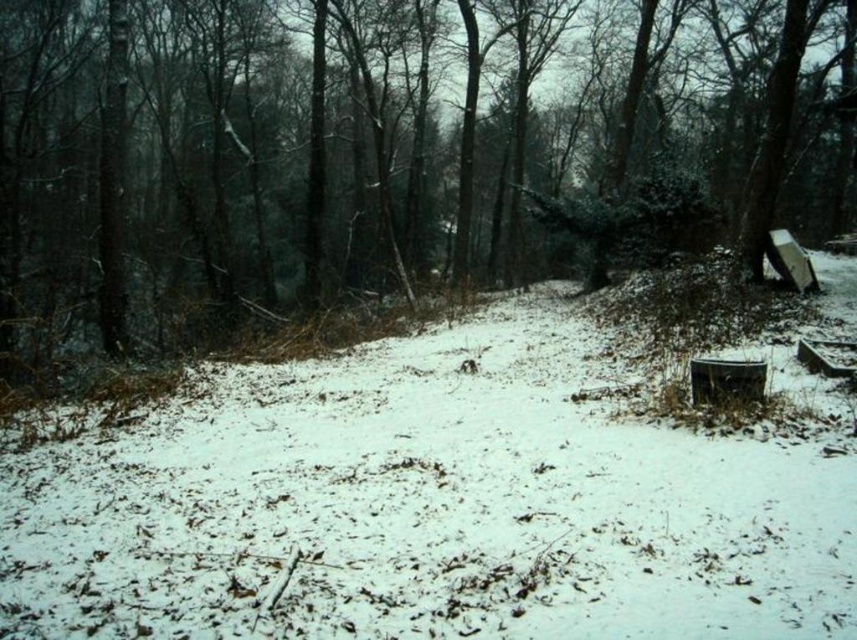
Question: Is snow-covered tree at center to the right of white matte snow at center from the viewer's perspective?

Choices:
 (A) no
 (B) yes

Answer: (B)

Question: Which point is closer to the camera?

Choices:
 (A) snow-covered tree at center
 (B) white matte snow at center

Answer: (B)

Question: Considering the relative positions of snow-covered tree at center and white matte snow at center in the image provided, where is snow-covered tree at center located with respect to white matte snow at center?

Choices:
 (A) above
 (B) below

Answer: (A)

Question: Does snow-covered tree at center appear over white matte snow at center?

Choices:
 (A) no
 (B) yes

Answer: (B)

Question: Among these objects, which one is farthest from the camera?

Choices:
 (A) snow-covered tree at center
 (B) white matte snow at center

Answer: (A)